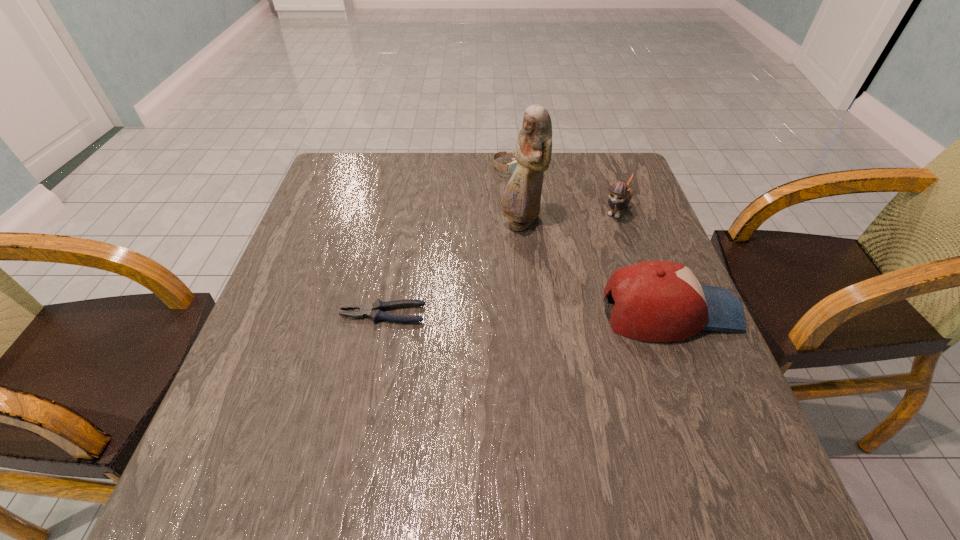
The image size is (960, 540). I want to click on the shortest object, so click(x=375, y=310).

Locate an element on the screen. the leftmost object is located at coordinates (375, 310).

Where is `baseball cap`? baseball cap is located at coordinates coord(655,301).

At what (x,y) coordinates should I click in order to perform the action: click on kitten. Please return your answer as a coordinate pair (x, y). The width and height of the screenshot is (960, 540). Looking at the image, I should click on (620, 194).

Find the location of a particular element. figurine is located at coordinates (521, 200).

Identify the location of watch. (512, 166).

Where is `the farthest object`? the farthest object is located at coordinates (512, 166).

At what (x,y) coordinates should I click in order to perform the action: click on free space located 0.090m at the gripping part of the shortest object. Please return your answer as a coordinate pair (x, y). The width and height of the screenshot is (960, 540). Looking at the image, I should click on (299, 314).

This screenshot has width=960, height=540. Find the location of `free region located at the gripping part of the shortest object`. free region located at the gripping part of the shortest object is located at coordinates (284, 314).

This screenshot has width=960, height=540. Identify the location of vacant space located at the gripping part of the shortest object. (275, 314).